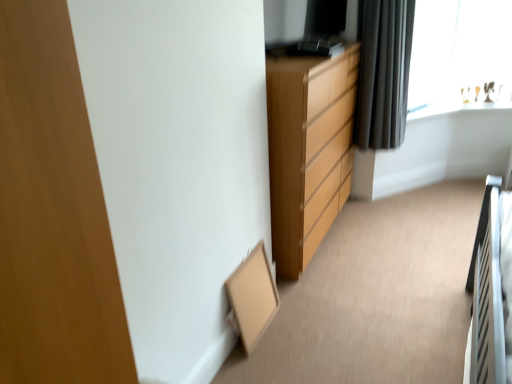
Question: Is matte wood chest of drawers at center aimed at transparent glass window at upper right?

Choices:
 (A) no
 (B) yes

Answer: (A)

Question: Considering the relative sizes of matte wood chest of drawers at center and transparent glass window at upper right in the image provided, is matte wood chest of drawers at center thinner than transparent glass window at upper right?

Choices:
 (A) no
 (B) yes

Answer: (A)

Question: Considering the relative sizes of matte wood chest of drawers at center and transparent glass window at upper right in the image provided, is matte wood chest of drawers at center wider than transparent glass window at upper right?

Choices:
 (A) yes
 (B) no

Answer: (A)

Question: Can you confirm if matte wood chest of drawers at center is taller than transparent glass window at upper right?

Choices:
 (A) yes
 (B) no

Answer: (A)

Question: Can you confirm if matte wood chest of drawers at center is positioned to the right of transparent glass window at upper right?

Choices:
 (A) no
 (B) yes

Answer: (A)

Question: Is matte wood chest of drawers at center oriented away from transparent glass window at upper right?

Choices:
 (A) yes
 (B) no

Answer: (B)

Question: Does black fabric curtain at upper right have a lesser width compared to transparent glass window at upper right?

Choices:
 (A) yes
 (B) no

Answer: (B)

Question: Does black fabric curtain at upper right appear on the left side of transparent glass window at upper right?

Choices:
 (A) yes
 (B) no

Answer: (A)

Question: Considering the relative sizes of black fabric curtain at upper right and transparent glass window at upper right in the image provided, is black fabric curtain at upper right wider than transparent glass window at upper right?

Choices:
 (A) yes
 (B) no

Answer: (A)

Question: Does black fabric curtain at upper right have a smaller size compared to transparent glass window at upper right?

Choices:
 (A) no
 (B) yes

Answer: (A)

Question: Can you confirm if black fabric curtain at upper right is positioned to the right of transparent glass window at upper right?

Choices:
 (A) no
 (B) yes

Answer: (A)

Question: Is the surface of black fabric curtain at upper right in direct contact with transparent glass window at upper right?

Choices:
 (A) no
 (B) yes

Answer: (A)

Question: From the image's perspective, does transparent glass window at upper right appear higher than matte wood chest of drawers at center?

Choices:
 (A) no
 (B) yes

Answer: (B)